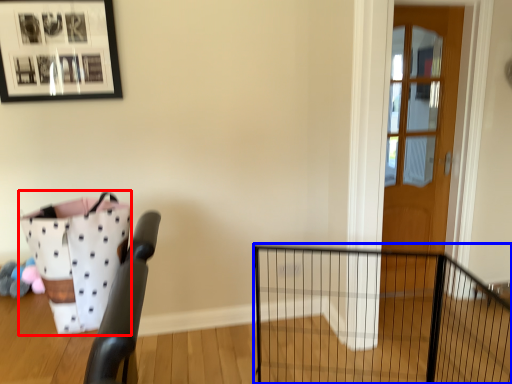
Question: Which of the following is the farthest to the observer, basket (highlighted by a red box) or fence (highlighted by a blue box)?

Choices:
 (A) basket
 (B) fence

Answer: (B)